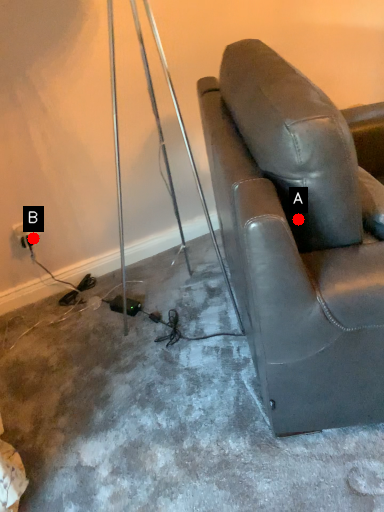
Question: Two points are circled on the image, labeled by A and B beside each circle. Which point is closer to the camera taking this photo?

Choices:
 (A) A is closer
 (B) B is closer

Answer: (A)